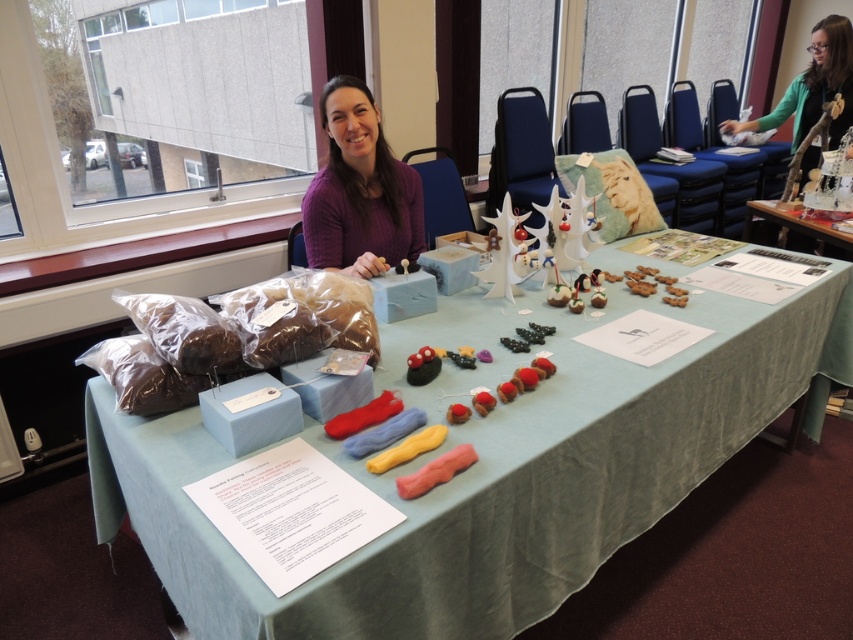
You are a customer at the craft fair and want to see both the light blue fabric at center and the purple soft sweater at center. Which one should you look down towards first?

The light blue fabric at center is below the purple soft sweater at center, so you should look down towards the purple soft sweater at center first to see both items.

You are standing at the craft fair and want to reach a point exactly 1.2 meters away from your current position. Is the point at coordinates point [306,340] within this range?

The point at coordinates point [306,340] is 1.34 meters away from the viewer, which is beyond the desired 1.2 meters range. Therefore, it is not within reach.

What is located at the point with coordinates (488,468) on the image?

The light blue fabric at center is located at point (488,468).